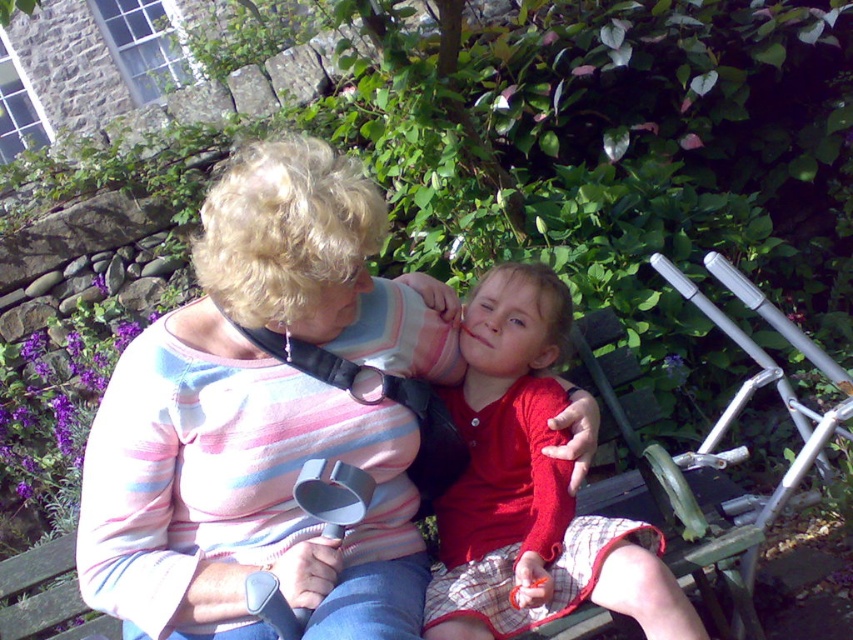
Consider the image. You are a photographer standing 3 feet away from the camera. You want to take a photo of the matte red sweater at center. Can you reach the camera in time to take the photo before the subjects move?

The matte red sweater at center and camera are 3.42 feet apart. Since you are already 3 feet away from the camera, you are close enough to reach the camera and take the photo before the subjects move.

You are a photographer trying to capture a closeup of the striped cotton sweater at center without the silver metallic baby carriage at right blocking the view. Based on their positions, is this possible?

Yes, the striped cotton sweater at center is closer to the viewer than the silver metallic baby carriage at right, so the photographer can position themselves to focus on the sweater without obstruction from the carriage.

You are a fashion designer observing a mother and child sitting on a bench. You notice the striped cotton sweater at center and the smooth red shirt at center. Which clothing item is positioned lower on the body?

The striped cotton sweater at center is below smooth red shirt at center, so the striped cotton sweater at center is positioned lower on the body.